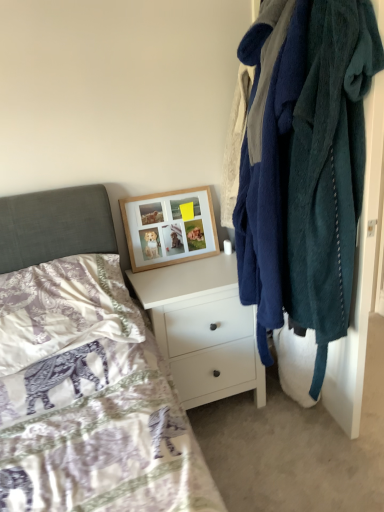
Question: Is point (188, 268) closer or farther from the camera than point (324, 354)?

Choices:
 (A) closer
 (B) farther

Answer: (B)

Question: Is white matte chest of drawers at center inside or outside of teal fuzzy robe at right?

Choices:
 (A) inside
 (B) outside

Answer: (B)

Question: Considering the real-world distances, which object is closest to the woodenobject at upper center?

Choices:
 (A) teal fuzzy robe at right
 (B) purple satin pillow at lower left
 (C) white matte chest of drawers at center

Answer: (C)

Question: Which object is the farthest from the white matte chest of drawers at center?

Choices:
 (A) purple satin pillow at lower left
 (B) woodenobject at upper center
 (C) teal fuzzy robe at right

Answer: (C)